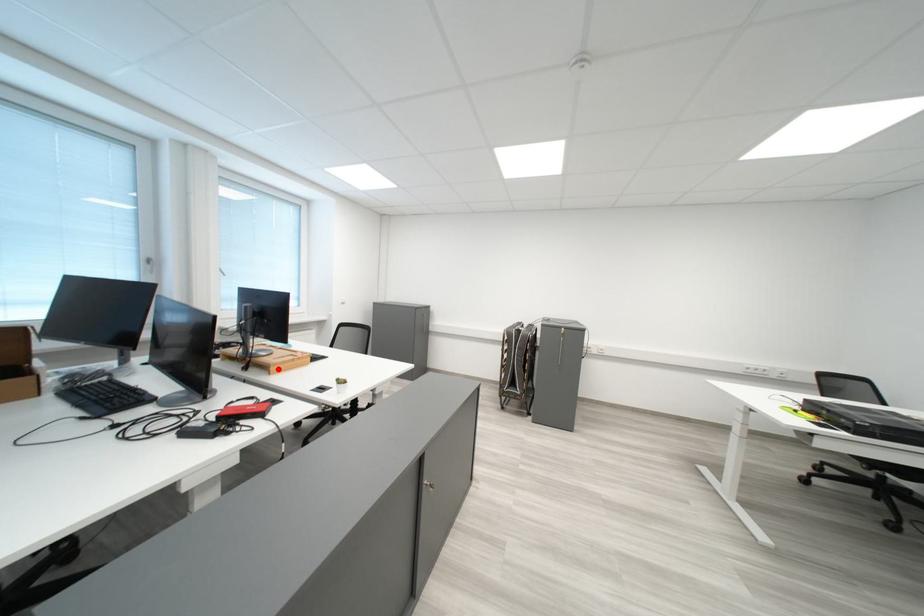
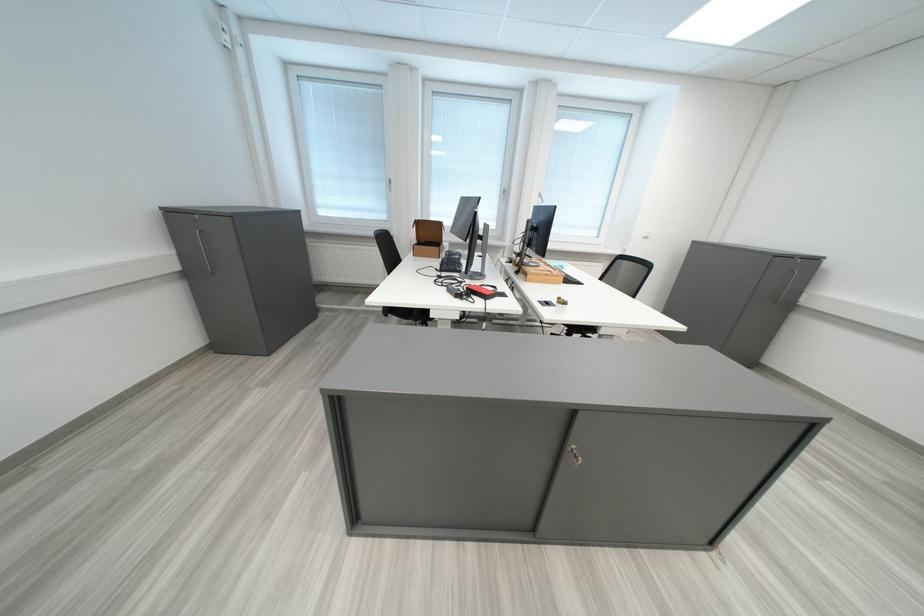
Find the pixel in the second image that matches the highlighted location in the first image.

(539, 276)